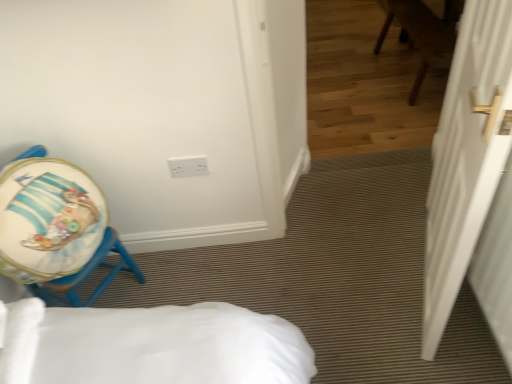
You are a GUI agent. You are given a task and a screenshot of the screen. Output one action in this format:
    pyautogui.click(x=<x>, y=<y>)
    Task: Click on the free region under white matte door at right (from a real-world perspective)
    The image size is (512, 384).
    Given the screenshot: What is the action you would take?
    pyautogui.click(x=419, y=281)